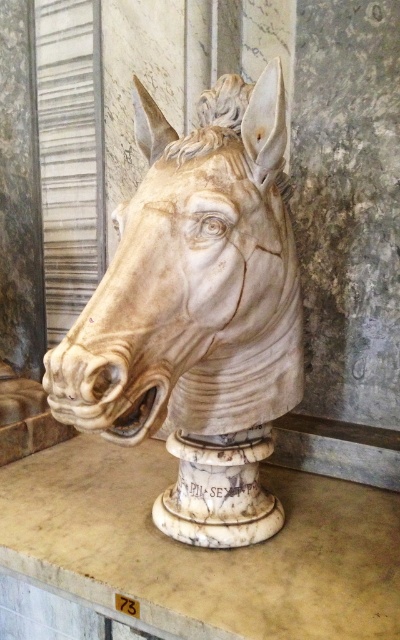
Question: Which of the following is the farthest from the observer?

Choices:
 (A) white marble horse head at center
 (B) white marble pedestal at center

Answer: (B)

Question: Is white marble horse head at center below white marble pedestal at center?

Choices:
 (A) no
 (B) yes

Answer: (A)

Question: Does white marble horse head at center have a lesser width compared to white marble pedestal at center?

Choices:
 (A) no
 (B) yes

Answer: (B)

Question: Which object appears closest to the camera in this image?

Choices:
 (A) white marble horse head at center
 (B) white marble pedestal at center

Answer: (A)

Question: Does white marble horse head at center come behind white marble pedestal at center?

Choices:
 (A) yes
 (B) no

Answer: (B)